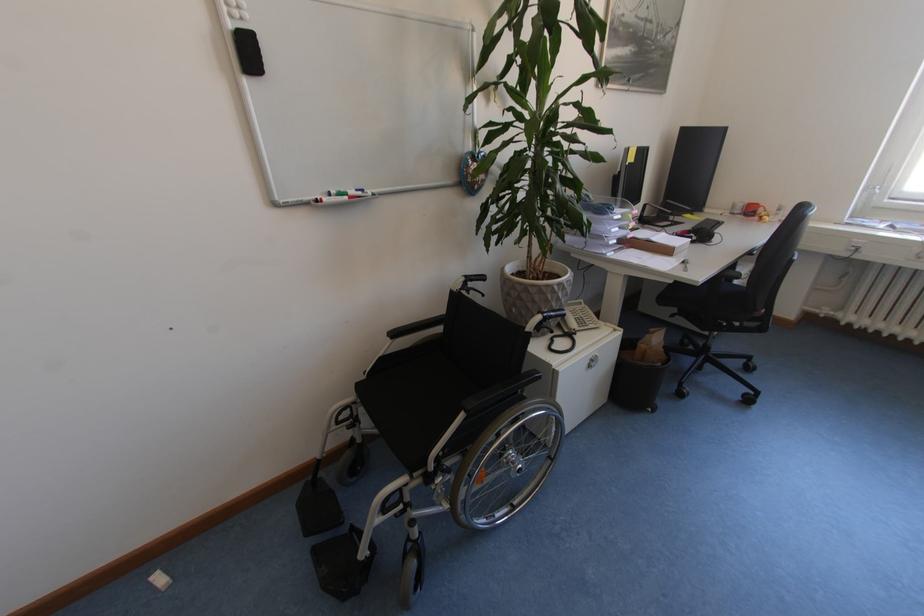
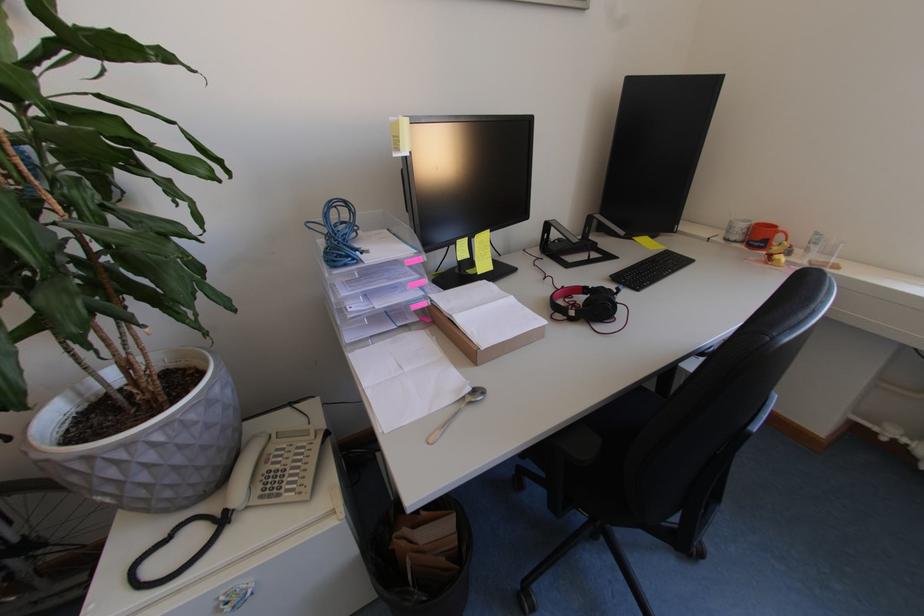
The point at [603,355] is marked in the first image. Where is the corresponding point in the second image?

(251, 585)